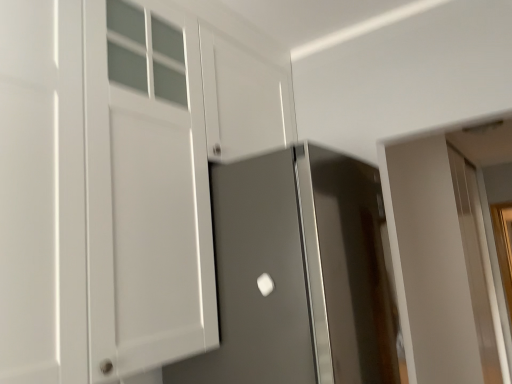
This screenshot has height=384, width=512. What do you see at coordinates (265, 284) in the screenshot?
I see `white glossy door handle at center` at bounding box center [265, 284].

What is the approximate width of white matte cabinet at left?

white matte cabinet at left is 13.46 inches in width.

The width and height of the screenshot is (512, 384). Find the location of `white glossy door at right, which is the second door in front-to-back order`. white glossy door at right, which is the second door in front-to-back order is located at coordinates 429,263.

This screenshot has height=384, width=512. What do you see at coordinates (429, 263) in the screenshot?
I see `white glossy door at right, the 1th door positioned from the right` at bounding box center [429, 263].

You are a GUI agent. You are given a task and a screenshot of the screen. Output one action in this format:
    pyautogui.click(x=<x>, y=<y>)
    Task: Click on the white glossy door handle at center
    This screenshot has height=384, width=512.
    Given the screenshot: What is the action you would take?
    pyautogui.click(x=265, y=284)

Is satin gray door at center, which is the second door from back to front, at the right side of white glossy door handle at center?

Yes.

Is satin gray door at center, the second door from the right, situated inside white glossy door handle at center or outside?

satin gray door at center, the second door from the right, is not inside white glossy door handle at center, it's outside.

Is point (314, 380) positioned after point (271, 277)?

No, (314, 380) is closer to viewer.

Is satin gray door at center, which is the second door from back to front, wider than white glossy door handle at center?

Correct, the width of satin gray door at center, which is the second door from back to front, exceeds that of white glossy door handle at center.

Considering the relative sizes of white glossy door at right, the 1th door positioned from the right, and white matte cabinet at left in the image provided, is white glossy door at right, the 1th door positioned from the right, smaller than white matte cabinet at left?

Actually, white glossy door at right, the 1th door positioned from the right, might be larger than white matte cabinet at left.

Does white glossy door at right, which is the second door in front-to-back order, have a greater height compared to white matte cabinet at left?

Indeed, white glossy door at right, which is the second door in front-to-back order, has a greater height compared to white matte cabinet at left.

Is white glossy door at right, which is the second door in front-to-back order, looking in the opposite direction of white matte cabinet at left?

No, white glossy door at right, which is the second door in front-to-back order, is not facing away from white matte cabinet at left.

Between satin gray door at center, which is the second door from back to front, and white glossy door at right, the 1th door positioned from the back, which one has smaller width?

Thinner between the two is satin gray door at center, which is the second door from back to front.

How far apart are satin gray door at center, positioned as the first door in front-to-back order, and white glossy door at right, which is the second door in front-to-back order?

satin gray door at center, positioned as the first door in front-to-back order, and white glossy door at right, which is the second door in front-to-back order, are 2.00 meters apart from each other.

Which is more to the left, satin gray door at center, the second door from the right, or white glossy door at right, the second door from the left?

Positioned to the left is satin gray door at center, the second door from the right.

From the image's perspective, is satin gray door at center, which is the second door from back to front, below white glossy door at right, the 1th door positioned from the back?

Incorrect, from the image's perspective, satin gray door at center, which is the second door from back to front, is higher than white glossy door at right, the 1th door positioned from the back.

Is white matte cabinet at left not close to white glossy door handle at center?

No, there isn't a large distance between white matte cabinet at left and white glossy door handle at center.

Between white matte cabinet at left and white glossy door handle at center, which one has larger size?

Bigger between the two is white matte cabinet at left.

Would you say white glossy door handle at center is part of white matte cabinet at left's contents?

That's incorrect, white glossy door handle at center is not inside white matte cabinet at left.

Consider the image. Who is taller, white matte cabinet at left or white glossy door handle at center?

Standing taller between the two is white matte cabinet at left.

Does white glossy door at right, the 1th door positioned from the back, lie behind satin gray door at center, which is the 1th door from left to right?

That is True.

In the scene shown: Could you measure the distance between white glossy door at right, the 1th door positioned from the back, and satin gray door at center, the second door from the right?

They are 2.00 meters apart.

Is white glossy door at right, the second door from the left, thinner than satin gray door at center, which is the second door from back to front?

No, white glossy door at right, the second door from the left, is not thinner than satin gray door at center, which is the second door from back to front.

Consider the image. Considering the relative positions of white glossy door at right, the second door from the left, and satin gray door at center, the second door from the right, in the image provided, is white glossy door at right, the second door from the left, to the right of satin gray door at center, the second door from the right, from the viewer's perspective?

Yes, white glossy door at right, the second door from the left, is to the right of satin gray door at center, the second door from the right.

Is white matte cabinet at left bigger than white glossy door at right, the second door from the left?

No.

From the image's perspective, does white matte cabinet at left appear lower than white glossy door at right, the 1th door positioned from the back?

Actually, white matte cabinet at left appears above white glossy door at right, the 1th door positioned from the back, in the image.

Is white matte cabinet at left not inside white glossy door at right, the 1th door positioned from the back?

white matte cabinet at left is positioned outside white glossy door at right, the 1th door positioned from the back.

Does white matte cabinet at left have a greater height compared to white glossy door at right, the 1th door positioned from the back?

In fact, white matte cabinet at left may be shorter than white glossy door at right, the 1th door positioned from the back.

From the picture: Is white glossy door handle at center taller than white glossy door at right, the 1th door positioned from the right?

No.

Identify the location of the 2nd door positioned below the white glossy door handle at center (from the image's perspective). (429, 263).

From a real-world perspective, is white glossy door handle at center positioned over white glossy door at right, which is the second door in front-to-back order, based on gravity?

Yes.

Locate an element on the screen. door handle that is on the left side of satin gray door at center, positioned as the first door in front-to-back order is located at coordinates (265, 284).

The height and width of the screenshot is (384, 512). In order to click on cabinetry that appears above the white glossy door at right, the 1th door positioned from the back (from the image's perspective) in this screenshot , I will do `click(120, 176)`.

Based on their spatial positions, is white matte cabinet at left or white glossy door handle at center closer to white glossy door at right, which is the second door in front-to-back order?

Based on the image, white glossy door handle at center appears to be nearer to white glossy door at right, which is the second door in front-to-back order.

Looking at this image, when comparing their distances from white glossy door at right, the second door from the left, does white matte cabinet at left or satin gray door at center, which is the 1th door from left to right, seem closer?

satin gray door at center, which is the 1th door from left to right, is closer to white glossy door at right, the second door from the left.

Looking at the image, which one is located further to white glossy door handle at center, white matte cabinet at left or satin gray door at center, which is the 1th door from left to right?

white matte cabinet at left lies further to white glossy door handle at center than the other object.

When comparing their distances from satin gray door at center, which is the second door from back to front, does white matte cabinet at left or white glossy door handle at center seem closer?

Among the two, white glossy door handle at center is located nearer to satin gray door at center, which is the second door from back to front.

Based on their spatial positions, is white matte cabinet at left or white glossy door at right, the second door from the left, closer to satin gray door at center, positioned as the first door in front-to-back order?

The object closer to satin gray door at center, positioned as the first door in front-to-back order, is white matte cabinet at left.

Considering their positions, is white glossy door handle at center positioned closer to white glossy door at right, the 1th door positioned from the right, than satin gray door at center, positioned as the first door in front-to-back order?

satin gray door at center, positioned as the first door in front-to-back order.

From the image, which object appears to be nearer to white glossy door handle at center, white glossy door at right, which is the second door in front-to-back order, or satin gray door at center, positioned as the first door in front-to-back order?

satin gray door at center, positioned as the first door in front-to-back order, lies closer to white glossy door handle at center than the other object.

From the image, which object appears to be farther from satin gray door at center, which is the 1th door from left to right, white glossy door at right, the 1th door positioned from the right, or white glossy door handle at center?

Among the two, white glossy door at right, the 1th door positioned from the right, is located further to satin gray door at center, which is the 1th door from left to right.

Where is `door handle situated between white matte cabinet at left and white glossy door at right, the 1th door positioned from the right, from left to right`? door handle situated between white matte cabinet at left and white glossy door at right, the 1th door positioned from the right, from left to right is located at coordinates (265, 284).

Where is `door situated between white glossy door handle at center and white glossy door at right, which is the second door in front-to-back order, from left to right`? door situated between white glossy door handle at center and white glossy door at right, which is the second door in front-to-back order, from left to right is located at coordinates [x=298, y=273].

Locate an element on the screen. door handle between white matte cabinet at left and satin gray door at center, which is the 1th door from left to right, in the horizontal direction is located at coordinates (265, 284).

Locate an element on the screen. Image resolution: width=512 pixels, height=384 pixels. door situated between white matte cabinet at left and white glossy door at right, the second door from the left, from left to right is located at coordinates (298, 273).